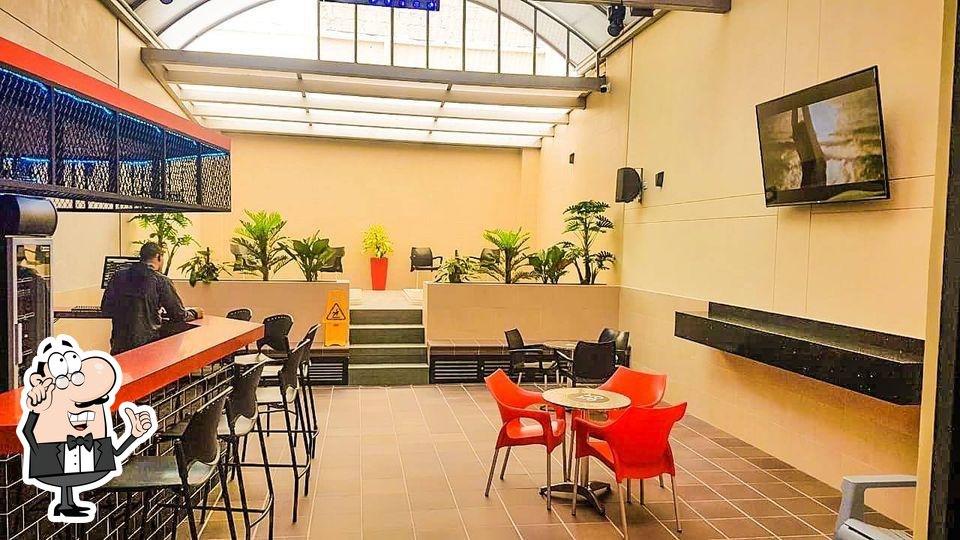
At what (x,y) coordinates should I click in order to perform the action: click on dark green plant leaves. Please return your answer as a coordinate pair (x, y). This screenshot has width=960, height=540. Looking at the image, I should click on (589, 207), (568, 227), (602, 260), (549, 263), (319, 249).